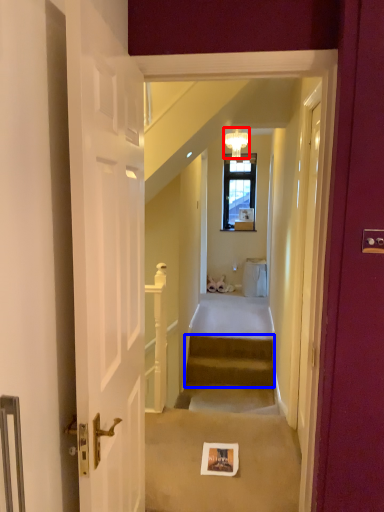
Question: Which point is closer to the camera, light fixture (highlighted by a red box) or stairs (highlighted by a blue box)?

Choices:
 (A) light fixture
 (B) stairs

Answer: (B)